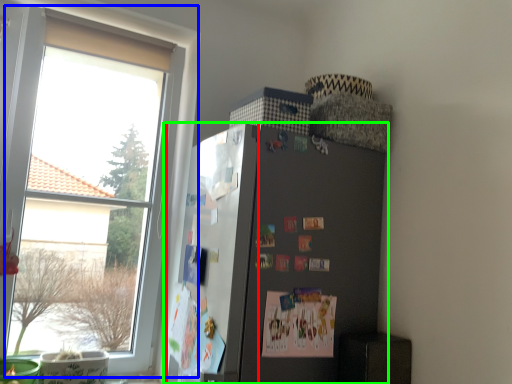
Question: Which is farther away from bulletin board (highlighted by a red box)? window (highlighted by a blue box) or refrigerator (highlighted by a green box)?

Choices:
 (A) window
 (B) refrigerator

Answer: (A)